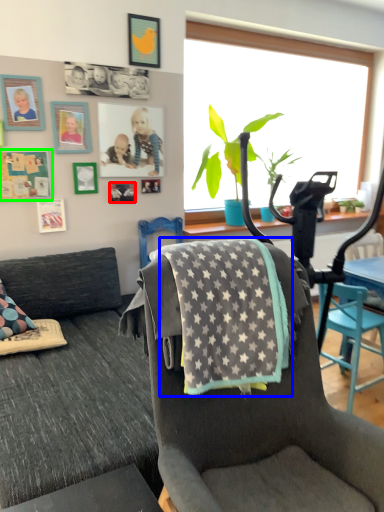
Question: Which object is positioned farthest from picture frame (highlighted by a red box)? Select from blanket (highlighted by a blue box) and picture frame (highlighted by a green box).

Choices:
 (A) blanket
 (B) picture frame

Answer: (A)